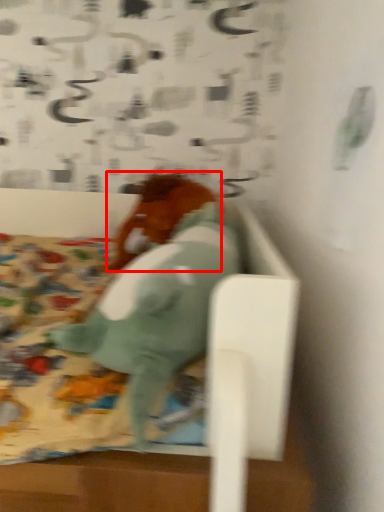
Question: Observing the image, what is the correct spatial positioning of animal (annotated by the red box) in reference to animal?

Choices:
 (A) right
 (B) left

Answer: (B)